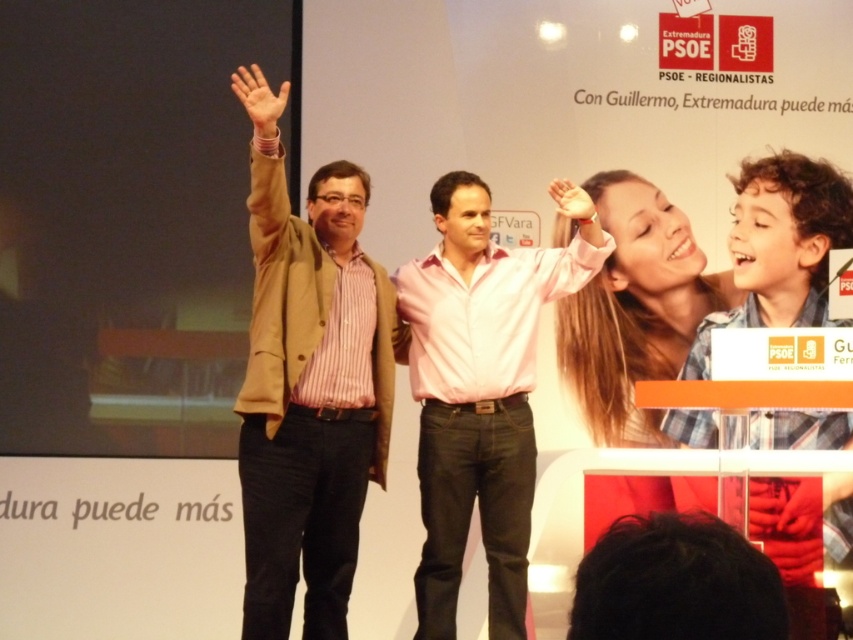
Based on the photo, you are a photographer at the event and need to ensure both the matte brown jacket at center and the pink cotton shirt at center are visible in the photo. Which one might you need to adjust your camera angle to focus on more carefully?

The matte brown jacket at center is larger in size than the pink cotton shirt at center, so you might need to focus more on the pink cotton shirt at center to ensure it is clearly visible in the photo.

You are a photographer taking a picture of the scene described. You want to ensure the matte brown jacket at center is centered in the photo. Given its current position at point coordinates, what adjustment should you make to the camera frame?

The matte brown jacket at center is already positioned at point coordinates, so no adjustment is needed as it is already centered.